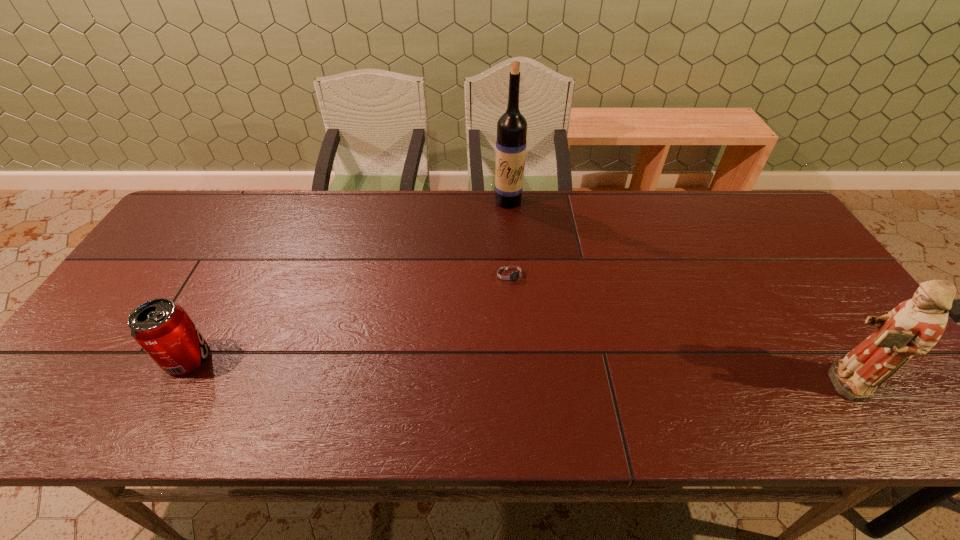
Locate an element on the screen. object that stands as the second closest to the figurine is located at coordinates (511, 142).

This screenshot has width=960, height=540. Find the location of `vacant space that satisfies the following two spatial constraints: 1. on the front side of the second shortest object; 2. on the front-facing side of the third shortest object`. vacant space that satisfies the following two spatial constraints: 1. on the front side of the second shortest object; 2. on the front-facing side of the third shortest object is located at coordinates (175, 382).

Image resolution: width=960 pixels, height=540 pixels. Identify the location of free spot that satisfies the following two spatial constraints: 1. on the back side of the farthest object; 2. on the left side of the watch. (507, 201).

Identify the location of free space that satisfies the following two spatial constraints: 1. on the back side of the watch; 2. on the left side of the third tallest object. The height and width of the screenshot is (540, 960). (233, 274).